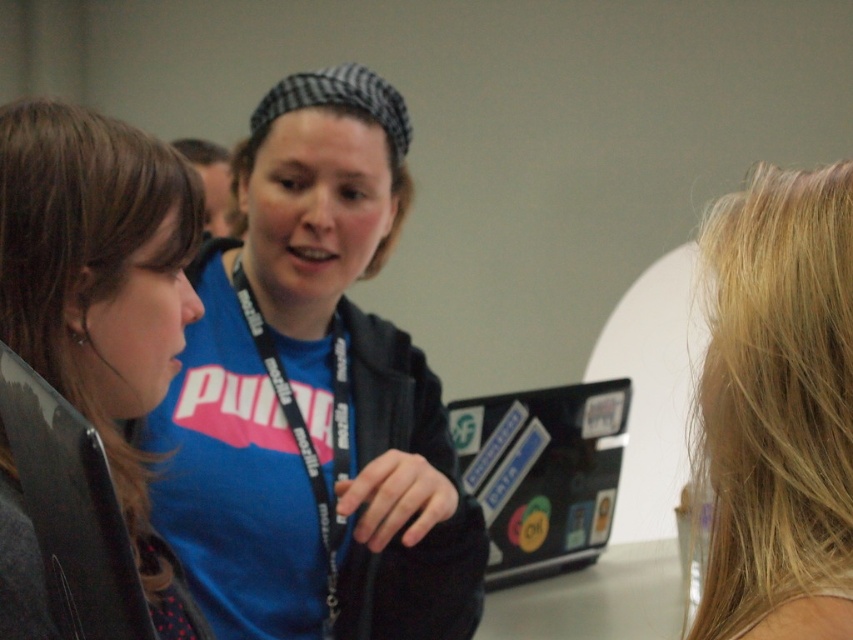
Based on the scene description, if you were to compare the sizes of the matte blue shirt at center and the matte black laptop at left, which object would appear bigger in the image?

The matte blue shirt at center appears larger than the matte black laptop at left in the image.

You are a person who needs to reach the matte black laptop at left from where you are standing next to the matte blue shirt at center. Can you comfortably reach it without moving your body?

The distance between the matte blue shirt at center and the matte black laptop at left is 13.46 inches. Since this distance is within typical arm reach, you can comfortably reach the matte black laptop at left without moving your body.